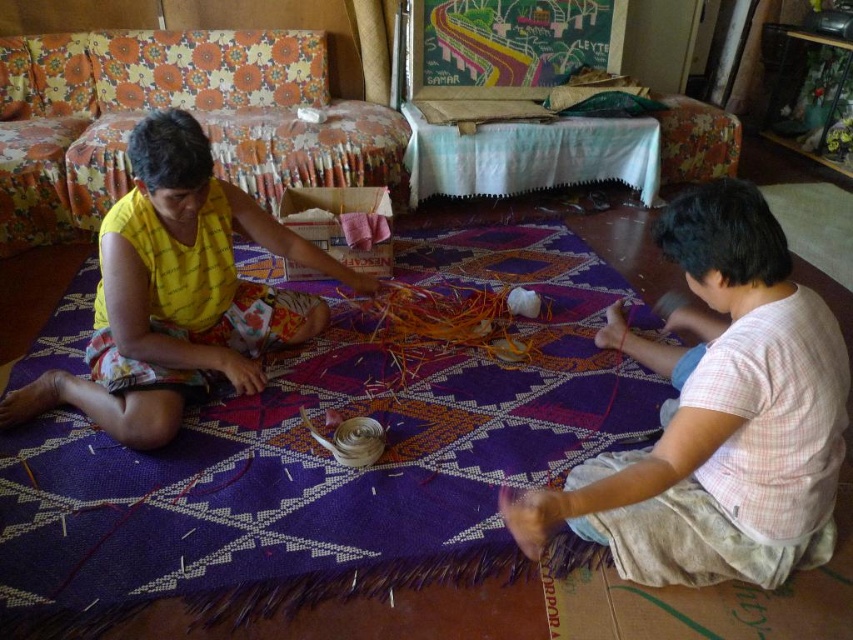
You are standing in front of the craft setup. There is a point marked at coordinates (718, 417). What object is located at that point?

The point at coordinates (718, 417) indicates the light pink plaid shirt at right.

You are a delivery robot that is 1 meter wide. You need to deliver a package from the entrance to the craft area where the two people are working. There is a light pink plaid shirt at right and a yellow printed fabric at left in your way. Can you pass between them without moving any objects?

The light pink plaid shirt at right and yellow printed fabric at left are 1.13 meters apart, so yes, the robot can pass between them since the distance is wider than the robot.

In the scene shown: You are trying to find the light pink plaid shirt at right and the yellow printed fabric at left in the image. Which one is located to the right side of the other?

The light pink plaid shirt at right is to the right of the yellow printed fabric at left.